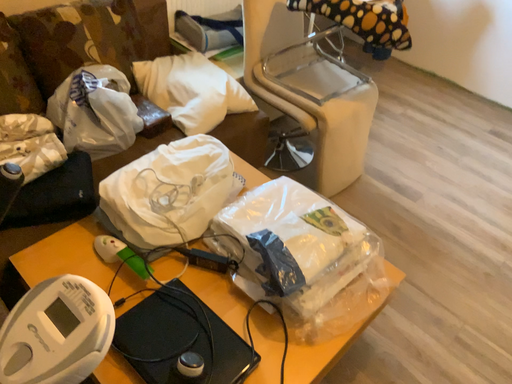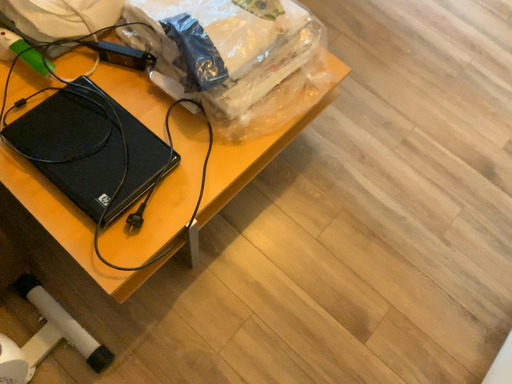
Question: Which way did the camera rotate in the video?

Choices:
 (A) rotated downward
 (B) rotated upward

Answer: (A)